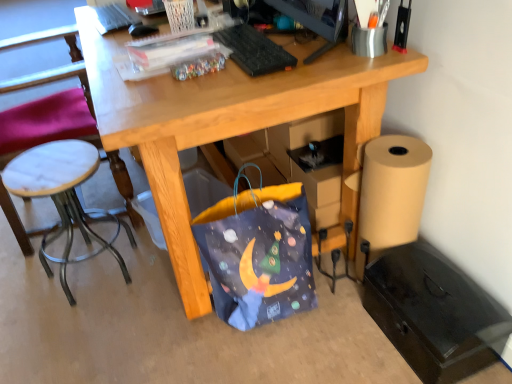
This screenshot has width=512, height=384. I want to click on vacant space that is to the left of black matte file cabinet at lower right, so click(343, 345).